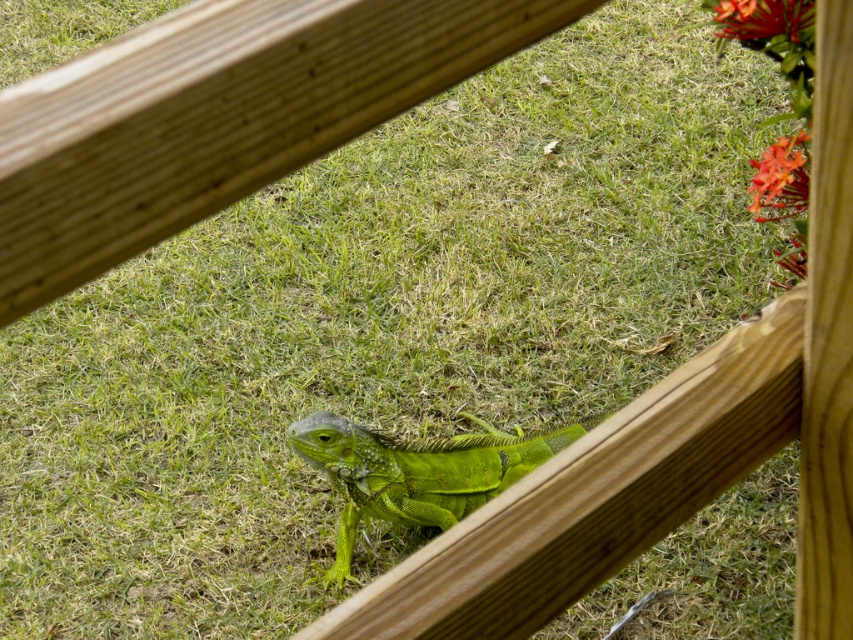
You are a photographer trying to capture the green scaly lizard at center. You notice the light brown wooden rail at center in the foreground. Will the rail block your view of the lizard?

The light brown wooden rail at center is in front of the green scaly lizard at center, so it will block part of the lizard from view.

You are standing in front of a fence with two wooden planks. You notice two points marked on the planks at coordinates point (367, 17) and point (790, 195). Which point is closer to you?

Point (367, 17) is closer to the viewer than point (790, 195).